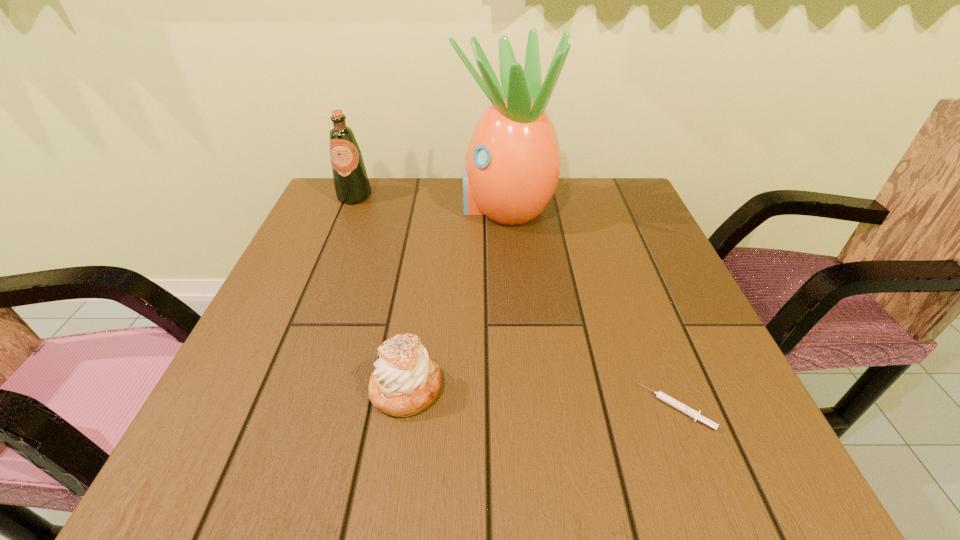
Find the location of a particular element. Image resolution: width=960 pixels, height=540 pixels. the tallest object is located at coordinates (513, 161).

The width and height of the screenshot is (960, 540). Identify the location of the second object from right to left. (513, 161).

You are a GUI agent. You are given a task and a screenshot of the screen. Output one action in this format:
    pyautogui.click(x=<x>, y=<y>)
    Task: Click on the second tallest object
    
    Given the screenshot: What is the action you would take?
    tap(351, 183)

Locate an element on the screen. This screenshot has height=540, width=960. the leftmost object is located at coordinates (351, 183).

Identify the location of the third tallest object. (406, 380).

This screenshot has height=540, width=960. Identify the location of the second object from left to right. (406, 380).

The height and width of the screenshot is (540, 960). What are the coordinates of `syringe` in the screenshot? It's located at click(694, 414).

This screenshot has height=540, width=960. Find the location of `the rightmost object`. the rightmost object is located at coordinates (694, 414).

Locate an element on the screen. vacant area situated 0.130m at the entrance of the second object from right to left is located at coordinates (406, 207).

Image resolution: width=960 pixels, height=540 pixels. In order to click on vacant point located at the entrance of the second object from right to left in this screenshot , I will do `click(433, 207)`.